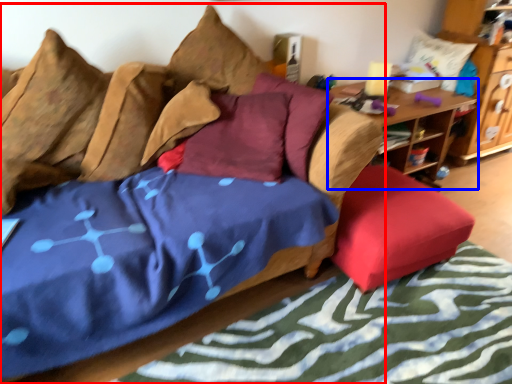
Question: Among these objects, which one is nearest to the camera, studio couch (highlighted by a red box) or table (highlighted by a blue box)?

Choices:
 (A) studio couch
 (B) table

Answer: (A)